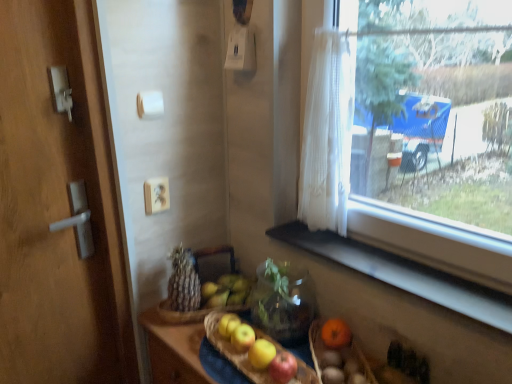
Image resolution: width=512 pixels, height=384 pixels. Describe the element at coordinates (226, 357) in the screenshot. I see `wooden basket at lower center, the second basket viewed from the right` at that location.

Describe the element at coordinates (327, 134) in the screenshot. I see `white sheer curtain at window` at that location.

What do you see at coordinates (407, 277) in the screenshot?
I see `transparent glass window at upper right` at bounding box center [407, 277].

You are a GUI agent. You are given a task and a screenshot of the screen. Output one action in this format:
    pyautogui.click(x=<x>, y=<y>)
    Task: Click on the black matte window sill at lower right
    Image resolution: width=512 pixels, height=384 pixels.
    Given the screenshot: What is the action you would take?
    pyautogui.click(x=403, y=274)

This screenshot has width=512, height=384. What do you see at coordinates (403, 274) in the screenshot?
I see `black matte window sill at lower right` at bounding box center [403, 274].

Locate an element on the screen. The width and height of the screenshot is (512, 384). wooden door handle at left is located at coordinates (57, 206).

This screenshot has width=512, height=384. I want to click on white plastic light switch at upper center, so click(241, 49).

Is point (313, 182) less distant than point (149, 111)?

No.

Is white sheer curtain at window situated inside white plastic knob at upper center or outside?

white sheer curtain at window exists outside the volume of white plastic knob at upper center.

Is white sheer curtain at window smaller than white plastic knob at upper center?

No, white sheer curtain at window is not smaller than white plastic knob at upper center.

Does transparent glass window at upper right have a smaller size compared to white sheer curtain at window?

No.

Is transparent glass window at upper right placed right next to white sheer curtain at window?

Yes.

In the scene shown: Could you tell me if transparent glass window at upper right is turned towards white sheer curtain at window?

Yes, transparent glass window at upper right faces towards white sheer curtain at window.

Is point (460, 228) closer to camera compared to point (308, 172)?

Yes.

Between black matte window sill at lower right and white plastic knob at upper center, which one has smaller width?

Thinner between the two is white plastic knob at upper center.

In the image, is black matte window sill at lower right on the left side or the right side of white plastic knob at upper center?

In the image, black matte window sill at lower right appears on the right side of white plastic knob at upper center.

Does point (385, 274) appear closer or farther from the camera than point (159, 93)?

Point (385, 274).

Is black matte window sill at lower right not close to white plastic knob at upper center?

black matte window sill at lower right is actually quite close to white plastic knob at upper center.

From the image's perspective, is white plastic knob at upper center positioned above or below white plastic light switch at upper center?

Clearly, from the image's perspective, white plastic knob at upper center is below white plastic light switch at upper center.

Is white plastic light switch at upper center completely or partially inside white plastic knob at upper center?

No, white plastic knob at upper center does not contain white plastic light switch at upper center.

This screenshot has height=384, width=512. Find the location of `light switch on the right of the white plastic knob at upper center`. light switch on the right of the white plastic knob at upper center is located at coordinates tap(241, 49).

From a real-world perspective, who is located lower, white plastic knob at upper center or white plastic light switch at upper center?

white plastic knob at upper center, from a real-world perspective.

Can you confirm if wooden basket at lower center, the first basket viewed from the left, is wider than transparent glass window at upper right?

Correct, the width of wooden basket at lower center, the first basket viewed from the left, exceeds that of transparent glass window at upper right.

Considering the points (219, 378) and (370, 238), which point is in front, point (219, 378) or point (370, 238)?

The point (219, 378) is closer to the camera.

Does wooden basket at lower center, the second basket viewed from the right, lie behind transparent glass window at upper right?

Yes, wooden basket at lower center, the second basket viewed from the right, is further from the camera.

Which of these two, wooden basket at lower center, the first basket viewed from the left, or transparent glass window at upper right, stands taller?

With more height is transparent glass window at upper right.

Would you consider brown textured bread at center to be distant from white sheer curtain at window?

Actually, brown textured bread at center and white sheer curtain at window are a little close together.

Is brown textured bread at center smaller than white sheer curtain at window?

Correct, brown textured bread at center occupies less space than white sheer curtain at window.

Considering their positions, is brown textured bread at center located in front of or behind white sheer curtain at window?

Clearly, brown textured bread at center is behind white sheer curtain at window.

Is white plastic light switch at upper center taller or shorter than white sheer curtain at window?

Clearly, white plastic light switch at upper center is shorter compared to white sheer curtain at window.

From the image's perspective, relative to white sheer curtain at window, is white plastic light switch at upper center above or below?

Based on their image positions, white plastic light switch at upper center is located above white sheer curtain at window.

From a real-world perspective, between white plastic light switch at upper center and white sheer curtain at window, who is vertically higher?

white plastic light switch at upper center.

What are the coordinates of `curtain on the right of white plastic knob at upper center` in the screenshot? It's located at (327, 134).

At what (x,y) coordinates should I click in order to perform the action: click on window below the white sheer curtain at window (from the image's perspective). Please return your answer as a coordinate pair (x, y). Looking at the image, I should click on (407, 277).

Consider the image. From the image, which object appears to be farther from white plastic light switch at upper center, black matte window sill at lower right or white matte electric outlet at upper center?

black matte window sill at lower right.

From the image, which object appears to be farther from wooden door handle at left, black matte window sill at lower right or transparent glass window at upper right?

black matte window sill at lower right is positioned further to the anchor wooden door handle at left.

Looking at the image, which one is located further to transparent glass window at upper right, brown textured bread at center or white sheer curtain at window?

brown textured bread at center is positioned further to the anchor transparent glass window at upper right.

When comparing their distances from matte brown wicker basket at lower right, the 1th basket positioned from the right, does white matte electric outlet at upper center or brown textured bread at center seem closer?

Among the two, brown textured bread at center is located nearer to matte brown wicker basket at lower right, the 1th basket positioned from the right.

In the scene shown: Considering their positions, is white plastic light switch at upper center positioned closer to black matte window sill at lower right than brown textured bread at center?

Based on the image, brown textured bread at center appears to be nearer to black matte window sill at lower right.

Which object lies nearer to the anchor point wooden door handle at left, brown textured bread at center or white plastic knob at upper center?

brown textured bread at center.

From the image, which object appears to be nearer to transparent glass window at upper right, matte brown wicker basket at lower right, the 1th basket positioned from the right, or wooden basket at lower center, the second basket viewed from the right?

The object closer to transparent glass window at upper right is matte brown wicker basket at lower right, the 1th basket positioned from the right.

Estimate the real-world distances between objects in this image. Which object is further from white matte electric outlet at upper center, wooden basket at lower center, the first basket viewed from the left, or black matte window sill at lower right?

black matte window sill at lower right lies further to white matte electric outlet at upper center than the other object.

This screenshot has height=384, width=512. What are the coordinates of `basket between white matte electric outlet at upper center and matte brown wicker basket at lower right, the second basket when ordered from left to right, in the horizontal direction` in the screenshot? It's located at (226, 357).

You are a GUI agent. You are given a task and a screenshot of the screen. Output one action in this format:
    pyautogui.click(x=<x>, y=<y>)
    Task: Click on the food between white plastic light switch at upper center and matte brown wicker basket at lower right, the second basket when ordered from left to right, vertically
    The image size is (512, 384).
    Given the screenshot: What is the action you would take?
    pyautogui.click(x=183, y=282)

Locate an element on the screen. Image resolution: width=512 pixels, height=384 pixels. food between white sheer curtain at window and wooden basket at lower center, the second basket viewed from the right, from top to bottom is located at coordinates (183, 282).

Find the location of a particular element. The image size is (512, 384). curtain between white matte electric outlet at upper center and transparent glass window at upper right in the horizontal direction is located at coordinates (327, 134).